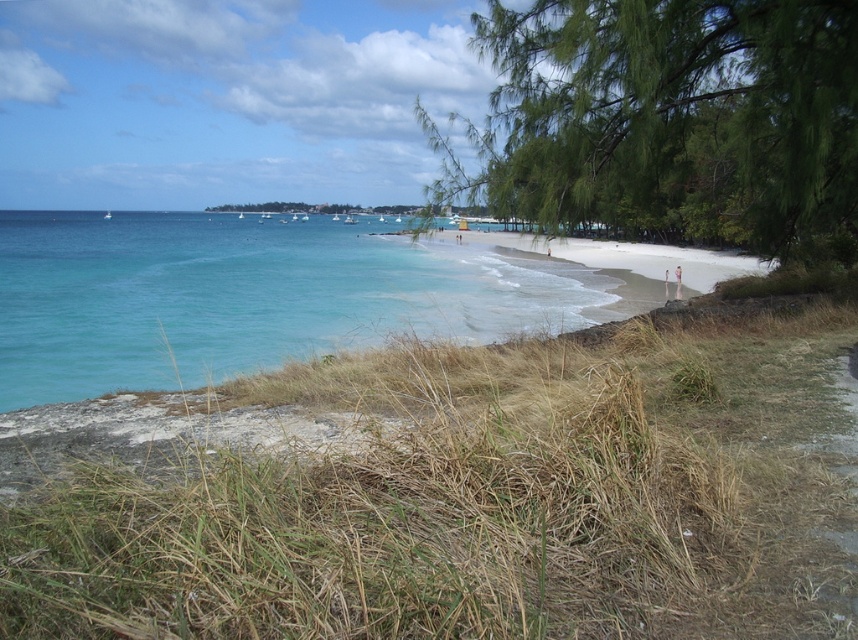
Question: Can you confirm if green leafy tree at upper right is bigger than turquoise water at left?

Choices:
 (A) yes
 (B) no

Answer: (A)

Question: Is green leafy tree at upper right below turquoise water at left?

Choices:
 (A) no
 (B) yes

Answer: (A)

Question: Which point is closer to the camera taking this photo?

Choices:
 (A) (575, 115)
 (B) (585, 300)

Answer: (A)

Question: Can you confirm if green leafy tree at upper right is bigger than turquoise water at left?

Choices:
 (A) no
 (B) yes

Answer: (B)